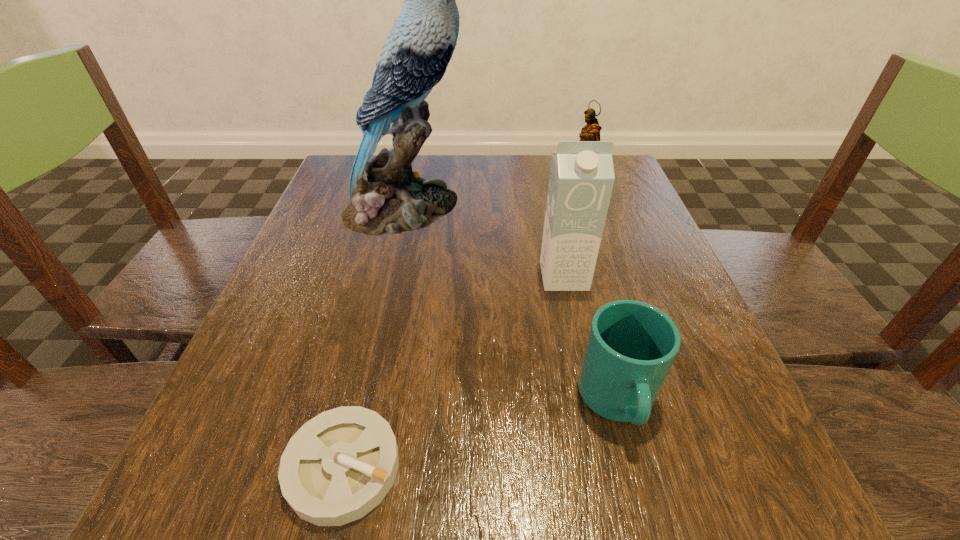
At what (x,y) coordinates should I click in order to perform the action: click on object that is at the far left corner. Please return your answer as a coordinate pair (x, y). Looking at the image, I should click on (387, 197).

Where is `object that is at the near left corner`? The image size is (960, 540). object that is at the near left corner is located at coordinates (338, 466).

The image size is (960, 540). Identify the location of object located at the far right corner. (591, 132).

Find the location of `free region at the far edge of the desktop`. free region at the far edge of the desktop is located at coordinates (483, 187).

Identify the location of vacant space at the near edge of the desktop. The image size is (960, 540). (561, 516).

In the image, there is a desktop. At what (x,y) coordinates should I click in order to perform the action: click on vacant space at the left edge. Please return your answer as a coordinate pair (x, y). This screenshot has width=960, height=540. Looking at the image, I should click on (276, 421).

Find the location of a particular element. vacant space at the right edge is located at coordinates (627, 208).

Where is `vacant point at the near left corner`? The image size is (960, 540). vacant point at the near left corner is located at coordinates (228, 521).

At what (x,y) coordinates should I click in order to perform the action: click on vacant space that is in between the tallest object and the ashtray. Please return your answer as a coordinate pair (x, y). This screenshot has height=540, width=960. Looking at the image, I should click on (374, 338).

Locate an element on the screen. This screenshot has width=960, height=540. free space between the ashtray and the figurine is located at coordinates (461, 333).